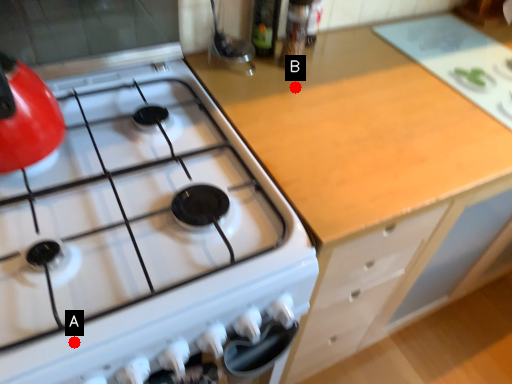
Question: Two points are circled on the image, labeled by A and B beside each circle. Which point is farther from the camera taking this photo?

Choices:
 (A) A is further
 (B) B is further

Answer: (B)